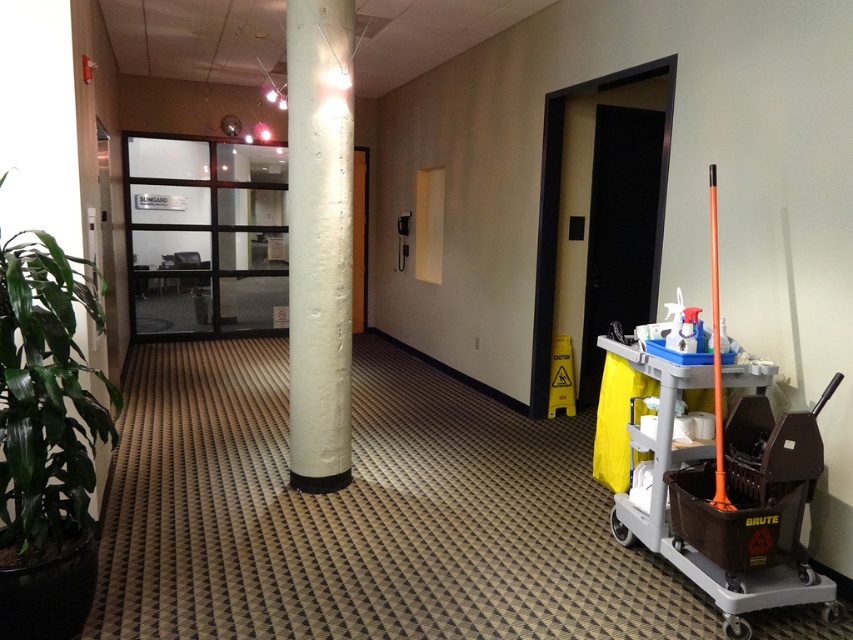
You are moving a box from the entrance to the office room. The entrance is where the large potted plant is located. You need to pass through the glass door with the black frame labeled SUNGARD. Where should you position the matte gray trolley at right to ensure it is closest to the door while staying in the hallway?

The matte gray trolley at right should be positioned at point (691, 540) to be closest to the door while remaining in the hallway.

You are a delivery person entering the hallway and need to place a package between the green leafy plant at left and the orange plastic pole at right. Can you fit the package there if it requires 1 meter of space?

The distance between the green leafy plant at left and orange plastic pole at right is 1.5 meters, so yes, the package requiring 1 meter of space can be placed there.

You are a delivery person carrying a package and need to navigate through the hallway. You see a matte gray trolley at right and an orange plastic pole at right. Which object is taller?

The orange plastic pole at right is taller than the matte gray trolley at right.